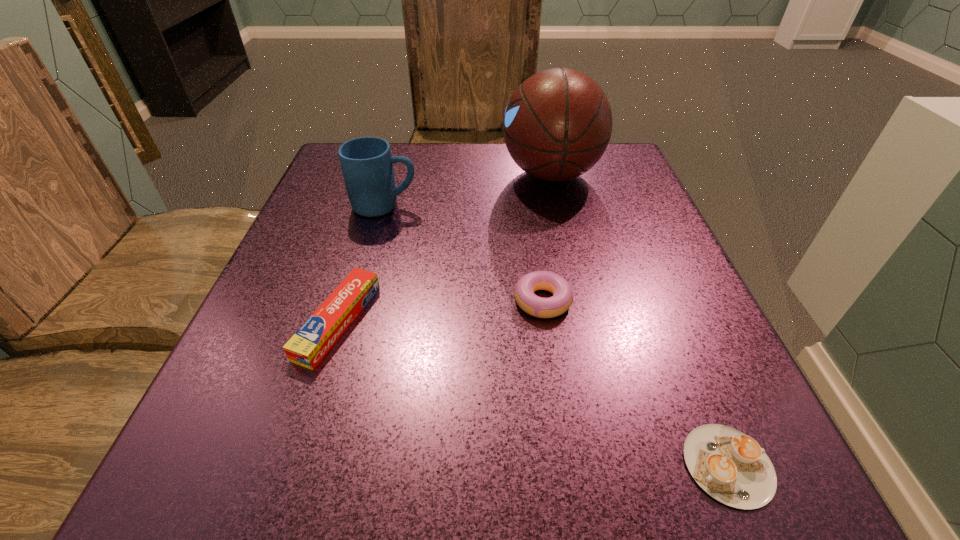
Identify the location of free space located 0.290m on the left of the nearest object. Image resolution: width=960 pixels, height=540 pixels. (435, 465).

The image size is (960, 540). Identify the location of basketball positioned at the far edge. (557, 125).

Where is `mug situated at the far edge`? mug situated at the far edge is located at coordinates (367, 164).

This screenshot has width=960, height=540. I want to click on object present at the near edge, so click(x=731, y=467).

Image resolution: width=960 pixels, height=540 pixels. In order to click on mug situated at the left edge in this screenshot , I will do `click(367, 164)`.

Identify the location of toothpaste at the left edge. The height and width of the screenshot is (540, 960). (307, 347).

Locate an element on the screen. The width and height of the screenshot is (960, 540). basketball that is at the right edge is located at coordinates (557, 125).

The image size is (960, 540). What are the coordinates of `cappuccino that is at the right edge` in the screenshot? It's located at tap(731, 467).

At what (x,y) coordinates should I click in order to perform the action: click on object that is at the far left corner. Please return your answer as a coordinate pair (x, y). Looking at the image, I should click on (367, 164).

Image resolution: width=960 pixels, height=540 pixels. Find the location of `object located at the far right corner`. object located at the far right corner is located at coordinates (557, 125).